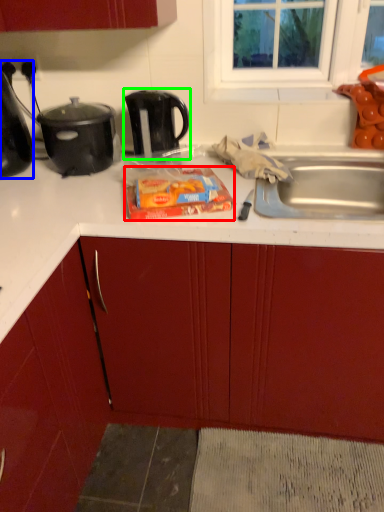
Question: Which object is positioned farthest from food (highlighted by a red box)? Select from kitchen appliance (highlighted by a blue box) and kettle (highlighted by a green box).

Choices:
 (A) kitchen appliance
 (B) kettle

Answer: (A)